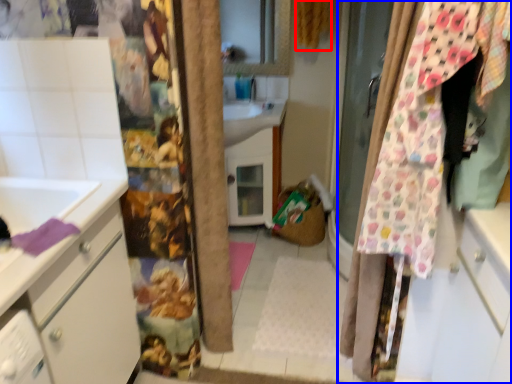
Question: Among these objects, which one is nearest to the camera, curtain (highlighted by a red box) or curtain (highlighted by a blue box)?

Choices:
 (A) curtain
 (B) curtain

Answer: (B)